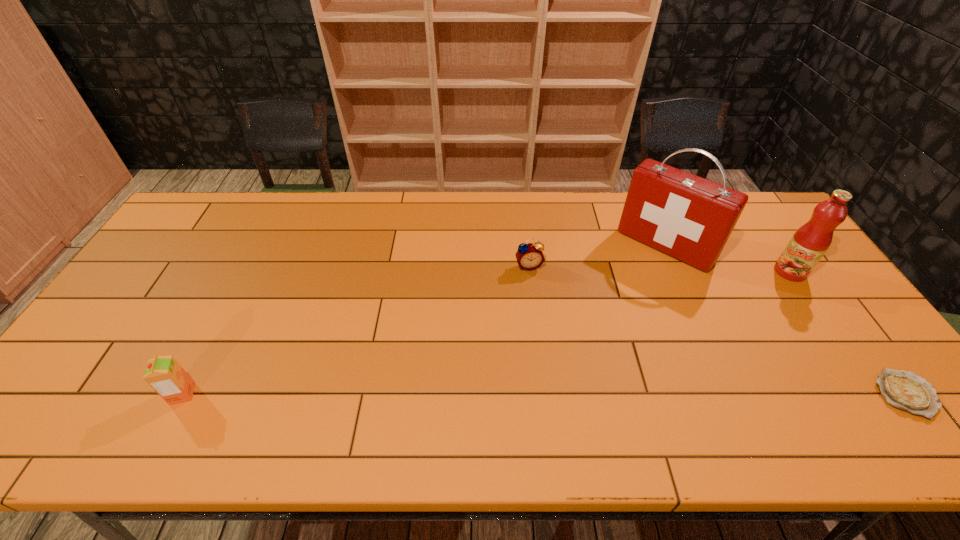
The width and height of the screenshot is (960, 540). I want to click on vacant area situated 0.310m on the front face of the third object from right to left, so click(x=591, y=330).

The height and width of the screenshot is (540, 960). Find the location of `free space located 0.350m on the front face of the third object from right to left`. free space located 0.350m on the front face of the third object from right to left is located at coordinates (584, 339).

Locate an element on the screen. The image size is (960, 540). vacant space located on the front face of the third object from right to left is located at coordinates tap(611, 308).

The height and width of the screenshot is (540, 960). I want to click on free space located on the front label of the fruit juice, so click(730, 323).

Image resolution: width=960 pixels, height=540 pixels. What are the coordinates of `free location located on the front label of the fruit juice` in the screenshot? It's located at (757, 300).

The width and height of the screenshot is (960, 540). In order to click on blank area located on the front label of the fruit juice in this screenshot , I will do `click(750, 306)`.

Locate an element on the screen. This screenshot has height=540, width=960. vacant area situated on the front-facing side of the alarm clock is located at coordinates (557, 356).

This screenshot has width=960, height=540. I want to click on vacant area located on the front-facing side of the alarm clock, so click(544, 313).

You are a GUI agent. You are given a task and a screenshot of the screen. Output one action in this format:
    pyautogui.click(x=<x>, y=<y>)
    Task: Click on the vacant space located on the front-facing side of the alarm clock
    This screenshot has width=960, height=540.
    Given the screenshot: What is the action you would take?
    pyautogui.click(x=565, y=384)

Where is `object that is at the far edge`? object that is at the far edge is located at coordinates (690, 218).